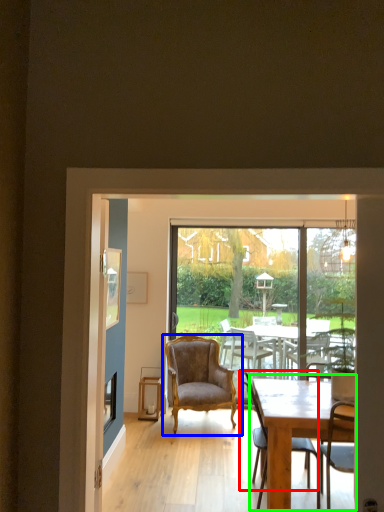
Question: Considering the real-world distances, which object is closest to chair (highlighted by a red box)? chair (highlighted by a blue box) or round table (highlighted by a green box).

Choices:
 (A) chair
 (B) round table

Answer: (B)